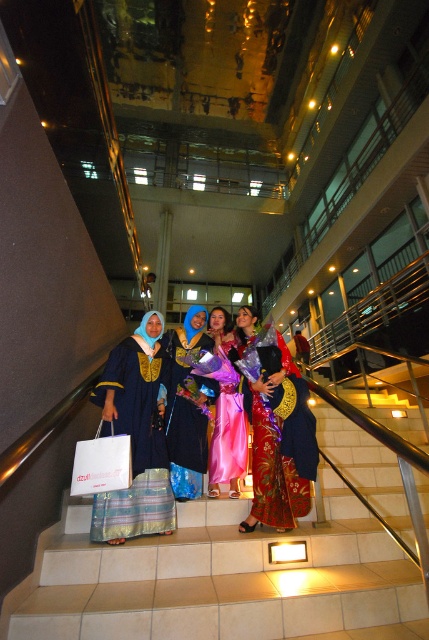
You are a photographer positioned at the bottom of the staircase. You need to capture a photo where both the silk floral dress at center and the silky blue dress at center are visible. Which dress should you focus on first to ensure the taller one is in frame?

The silk floral dress at center is taller than the silky blue dress at center, so you should focus on the silk floral dress at center first to ensure it is centered and in frame before adjusting for the shorter one.

In the scene shown: You are a photographer positioned at the top of the staircase. You want to capture a photo of the silky satin dress at center without the white paper shopping bag at lower left appearing in the background. Is this possible based on their positions?

The silky satin dress at center is in front of the white paper shopping bag at lower left, so if you position yourself so that the dress blocks the view of the bag, it should be possible to take a photo without the bag appearing in the background.